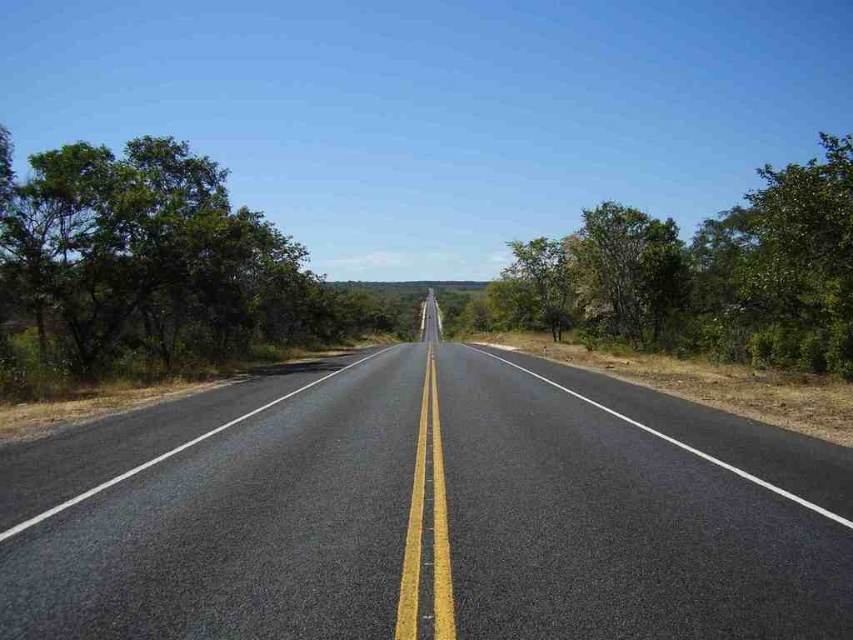
Is point (186, 416) positioned in front of point (115, 304)?

Yes, point (186, 416) is in front of point (115, 304).

Who is higher up, asphalt road at center or green leafy tree at left?

green leafy tree at left is above.

Find the location of a particular element. The width and height of the screenshot is (853, 640). asphalt road at center is located at coordinates (426, 513).

The height and width of the screenshot is (640, 853). I want to click on asphalt road at center, so click(426, 513).

Can you confirm if green leafy tree at left is positioned below green leafy tree at right?

Correct, green leafy tree at left is located below green leafy tree at right.

Is point (135, 252) less distant than point (828, 214)?

No, it is not.

This screenshot has height=640, width=853. What do you see at coordinates (151, 262) in the screenshot?
I see `green leafy tree at left` at bounding box center [151, 262].

Locate an element on the screen. The image size is (853, 640). green leafy tree at left is located at coordinates (151, 262).

Who is positioned more to the right, asphalt road at center or green leafy tree at right?

From the viewer's perspective, green leafy tree at right appears more on the right side.

Is point (508, 440) positioned in front of point (740, 227)?

Yes, point (508, 440) is closer to viewer.

Where is `asphalt road at center`? This screenshot has height=640, width=853. asphalt road at center is located at coordinates (426, 513).